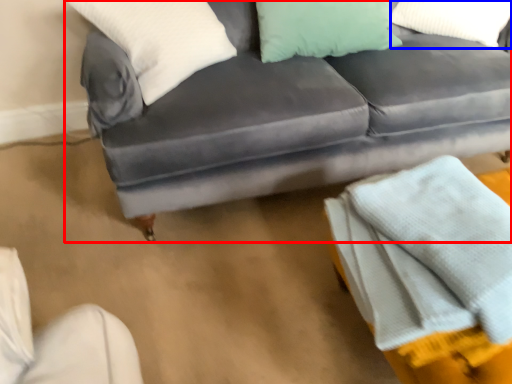
Question: Which object is closer to the camera taking this photo, studio couch (highlighted by a red box) or pillow (highlighted by a blue box)?

Choices:
 (A) studio couch
 (B) pillow

Answer: (A)